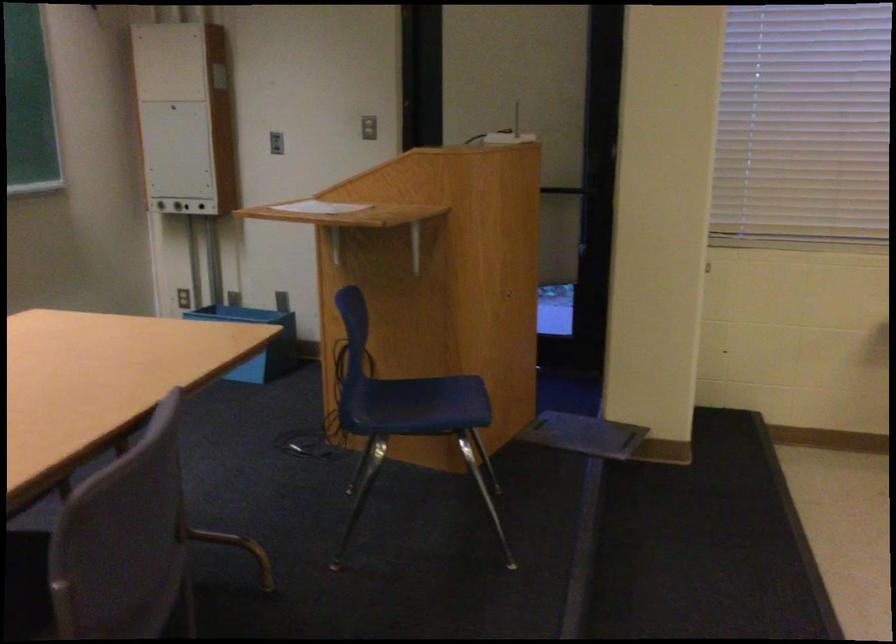
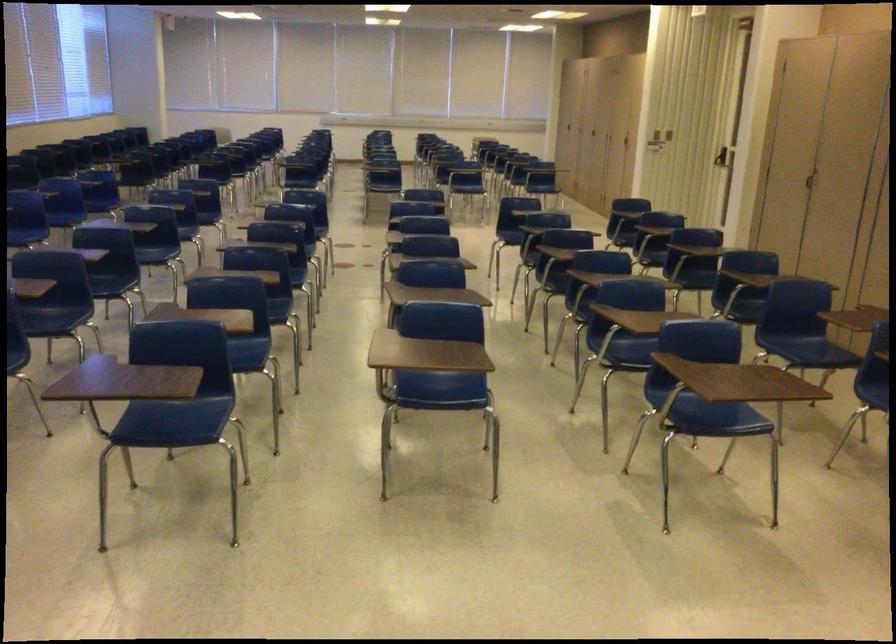
First-person continuous shooting, in which direction is the camera rotating?

The camera rotated toward right-down.